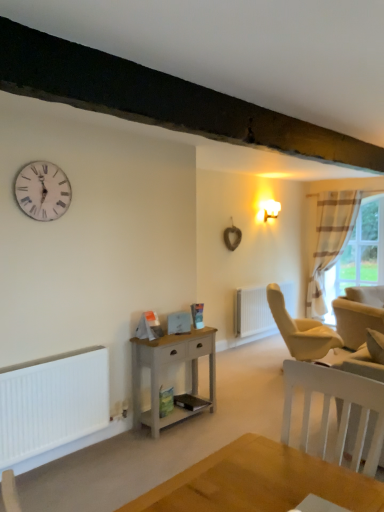
This screenshot has width=384, height=512. Describe the element at coordinates (252, 312) in the screenshot. I see `white matte radiator at center` at that location.

The height and width of the screenshot is (512, 384). Find the location of `plaid fabric curtain at right`. plaid fabric curtain at right is located at coordinates click(330, 241).

Measure the distance between light gray wood nightstand at center and camera.

light gray wood nightstand at center is 3.37 meters away from camera.

Locate an element on the screen. This screenshot has width=384, height=512. white matte radiator at center is located at coordinates (252, 312).

From the image's perspective, which one is positioned lower, light gray wood nightstand at center or matte gold wall sconce at upper right?

light gray wood nightstand at center.

Does light gray wood nightstand at center have a larger size compared to matte gold wall sconce at upper right?

Yes, light gray wood nightstand at center is bigger than matte gold wall sconce at upper right.

From a real-world perspective, is light gray wood nightstand at center above or below matte gold wall sconce at upper right?

In terms of real-world spatial position, light gray wood nightstand at center is below matte gold wall sconce at upper right.

How distant is light gray wood nightstand at center from matte gold wall sconce at upper right?

light gray wood nightstand at center is 12.35 feet away from matte gold wall sconce at upper right.

Can you confirm if matte gold wall sconce at upper right is positioned to the left of striped fabric curtain at right?

Correct, you'll find matte gold wall sconce at upper right to the left of striped fabric curtain at right.

Is matte gold wall sconce at upper right not close to striped fabric curtain at right?

Indeed, matte gold wall sconce at upper right is not near striped fabric curtain at right.

From the image's perspective, which is below, matte gold wall sconce at upper right or striped fabric curtain at right?

striped fabric curtain at right appears lower in the image.

At what (x,y) coordinates should I click in order to perform the action: click on bay window on the right side of matte gold wall sconce at upper right. Please return your answer as a coordinate pair (x, y). The image size is (384, 512). Looking at the image, I should click on (361, 252).

Would you say white wooden clock at upper left is part of white matte heater at lower left's contents?

Definitely not — white wooden clock at upper left is not inside white matte heater at lower left.

Can you confirm if white matte heater at lower left is positioned to the right of white wooden clock at upper left?

Indeed, white matte heater at lower left is positioned on the right side of white wooden clock at upper left.

From the picture: Could you tell me if white matte heater at lower left is facing white wooden clock at upper left?

No, white matte heater at lower left is not facing towards white wooden clock at upper left.

Does white matte heater at lower left have a greater width compared to white wooden clock at upper left?

Correct, the width of white matte heater at lower left exceeds that of white wooden clock at upper left.

What's the angular difference between beige fabric swivel chair at right and matte gold wall sconce at upper right's facing directions?

26.8 degrees separate the facing orientations of beige fabric swivel chair at right and matte gold wall sconce at upper right.

Considering the relative positions of beige fabric swivel chair at right and matte gold wall sconce at upper right in the image provided, is beige fabric swivel chair at right to the left or to the right of matte gold wall sconce at upper right?

In the image, beige fabric swivel chair at right appears on the right side of matte gold wall sconce at upper right.

Is there a large distance between beige fabric swivel chair at right and matte gold wall sconce at upper right?

Yes.

Could you tell me if beige fabric swivel chair at right is turned towards matte gold wall sconce at upper right?

No, beige fabric swivel chair at right is not aimed at matte gold wall sconce at upper right.

From a real-world perspective, which object rests below the other?

From a 3D spatial view, white matte radiator at center is below.

Is white matte radiator at center bigger than plaid fabric curtain at right?

Incorrect, white matte radiator at center is not larger than plaid fabric curtain at right.

In the scene shown: Is white matte radiator at center looking in the opposite direction of plaid fabric curtain at right?

No, white matte radiator at center's orientation is not away from plaid fabric curtain at right.

Based on the photo, does white matte radiator at center have a lesser width compared to plaid fabric curtain at right?

Yes.

Are white wooden clock at upper left and matte gold wall sconce at upper right located far from each other?

white wooden clock at upper left is far away from matte gold wall sconce at upper right.

From a real-world perspective, which is physically below, white wooden clock at upper left or matte gold wall sconce at upper right?

matte gold wall sconce at upper right.

Does point (43, 170) come behind point (268, 200)?

No, (43, 170) is closer to viewer.

From the image's perspective, is white matte heater at lower left under matte gold wall sconce at upper right?

Indeed, from the image's perspective, white matte heater at lower left is shown beneath matte gold wall sconce at upper right.

In the image, is white matte heater at lower left positioned in front of or behind matte gold wall sconce at upper right?

In the image, white matte heater at lower left appears in front of matte gold wall sconce at upper right.

What's the angular difference between white matte heater at lower left and matte gold wall sconce at upper right's facing directions?

white matte heater at lower left and matte gold wall sconce at upper right are facing 0.334 degrees away from each other.

Can you confirm if white matte heater at lower left is bigger than matte gold wall sconce at upper right?

Indeed, white matte heater at lower left has a larger size compared to matte gold wall sconce at upper right.

The width and height of the screenshot is (384, 512). What are the coordinates of `nightstand lying on the left of matte gold wall sconce at upper right` in the screenshot? It's located at (170, 366).

Identify the location of bay window that appears below the matte gold wall sconce at upper right (from a real-world perspective). (361, 252).

From the image, which object appears to be farther from light gray wood nightstand at center, white matte radiator at center or matte gold wall sconce at upper right?

matte gold wall sconce at upper right lies further to light gray wood nightstand at center than the other object.

From the image, which object appears to be farther from white matte heater at lower left, light gray wood nightstand at center or plaid fabric curtain at right?

plaid fabric curtain at right is further to white matte heater at lower left.

Based on their spatial positions, is white matte radiator at center or striped fabric curtain at right closer to white matte heater at lower left?

white matte radiator at center is positioned closer to the anchor white matte heater at lower left.

When comparing their distances from plaid fabric curtain at right, does white matte heater at lower left or matte gold wall sconce at upper right seem further?

The object further to plaid fabric curtain at right is white matte heater at lower left.

Based on their spatial positions, is plaid fabric curtain at right or light gray wood nightstand at center closer to striped fabric curtain at right?

plaid fabric curtain at right is positioned closer to the anchor striped fabric curtain at right.

Based on their spatial positions, is beige fabric swivel chair at right or plaid fabric curtain at right further from white wooden clock at upper left?

plaid fabric curtain at right is positioned further to the anchor white wooden clock at upper left.

Which object lies further to the anchor point beige fabric swivel chair at right, white matte radiator at center or plaid fabric curtain at right?

Among the two, plaid fabric curtain at right is located further to beige fabric swivel chair at right.

From the image, which object appears to be farther from white wooden clock at upper left, plaid fabric curtain at right or matte gold wall sconce at upper right?

plaid fabric curtain at right.

Locate an element on the screen. The width and height of the screenshot is (384, 512). nightstand positioned between white matte heater at lower left and white matte radiator at center from near to far is located at coordinates (170, 366).

I want to click on nightstand positioned between white matte heater at lower left and matte gold wall sconce at upper right from near to far, so click(x=170, y=366).

I want to click on radiator between light gray wood nightstand at center and plaid fabric curtain at right in the front-back direction, so click(x=252, y=312).

Identify the location of radiator located between white matte heater at lower left and beige fabric swivel chair at right in the left-right direction. (252, 312).